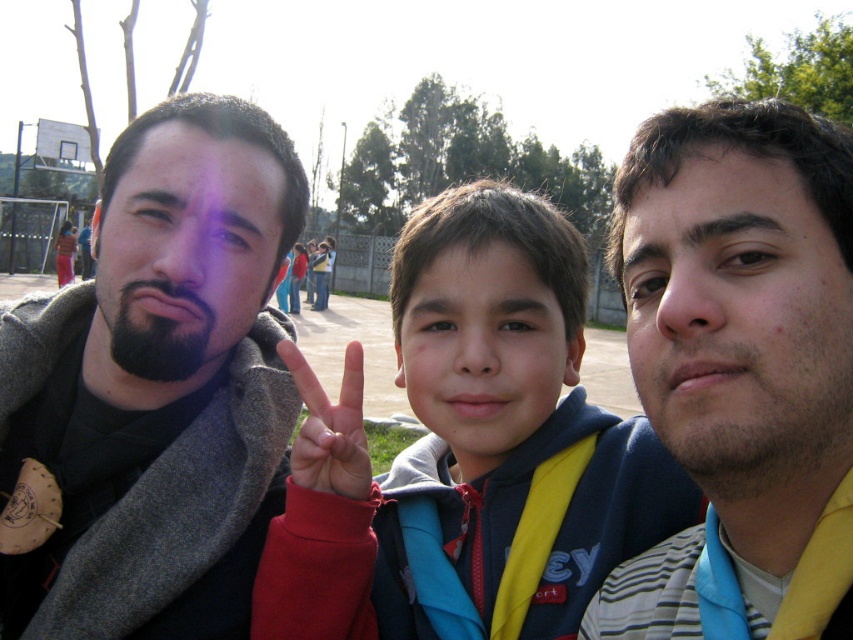
Question: Can you confirm if smooth skin face at center is bigger than matte red hand at center?

Choices:
 (A) yes
 (B) no

Answer: (A)

Question: Among these objects, which one is farthest from the camera?

Choices:
 (A) matte gray scarf at left
 (B) smooth skin face at right
 (C) gray wool scarf at left

Answer: (A)

Question: Which of the following is the farthest from the observer?

Choices:
 (A) matte gray scarf at left
 (B) blue fleece jacket at center
 (C) smooth skin face at right
 (D) matte red hand at center

Answer: (B)

Question: Is gray wool scarf at left further to camera compared to blue fleece jacket at center?

Choices:
 (A) no
 (B) yes

Answer: (A)

Question: Does gray wool scarf at left come in front of matte red hand at center?

Choices:
 (A) no
 (B) yes

Answer: (A)

Question: Which point is farther to the camera?

Choices:
 (A) blue fleece jacket at center
 (B) gray wool scarf at left
 (C) matte gray scarf at left
 (D) smooth skin face at right

Answer: (A)